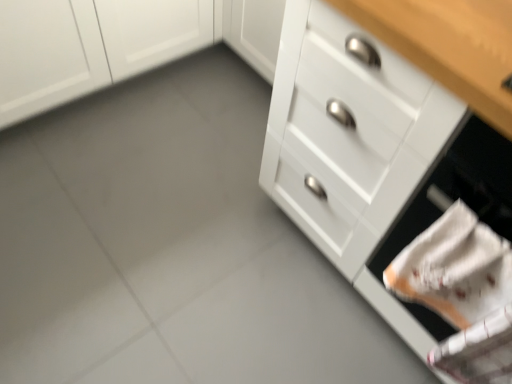
Question: Should I look upward or downward to see white matte cabinet at upper left?

Choices:
 (A) down
 (B) up

Answer: (B)

Question: Would you say white glossy drawer at right is part of white matte cabinet at upper left's contents?

Choices:
 (A) no
 (B) yes

Answer: (A)

Question: Can you confirm if white matte cabinet at upper left is taller than white glossy drawer at right?

Choices:
 (A) no
 (B) yes

Answer: (A)

Question: Is white matte cabinet at upper left not near white glossy drawer at right?

Choices:
 (A) no
 (B) yes

Answer: (A)

Question: From a real-world perspective, is white matte cabinet at upper left positioned over white glossy drawer at right based on gravity?

Choices:
 (A) yes
 (B) no

Answer: (B)

Question: Can you confirm if white matte cabinet at upper left is positioned to the right of white glossy drawer at right?

Choices:
 (A) yes
 (B) no

Answer: (B)

Question: Is white matte cabinet at upper left positioned in front of white glossy drawer at right?

Choices:
 (A) yes
 (B) no

Answer: (B)

Question: Does white glossy drawer at right have a lesser width compared to white matte cabinet at upper left?

Choices:
 (A) yes
 (B) no

Answer: (A)

Question: Is white glossy drawer at right located outside white matte cabinet at upper left?

Choices:
 (A) no
 (B) yes

Answer: (B)

Question: Does white glossy drawer at right lie in front of white matte cabinet at upper left?

Choices:
 (A) no
 (B) yes

Answer: (B)

Question: From a real-world perspective, is white glossy drawer at right physically above white matte cabinet at upper left?

Choices:
 (A) yes
 (B) no

Answer: (A)

Question: Is white glossy drawer at right not close to white matte cabinet at upper left?

Choices:
 (A) no
 (B) yes

Answer: (A)

Question: From the image's perspective, would you say white glossy drawer at right is shown under white matte cabinet at upper left?

Choices:
 (A) yes
 (B) no

Answer: (A)

Question: From the image's perspective, is white glossy drawer at right under white matte drawer at lower right?

Choices:
 (A) yes
 (B) no

Answer: (B)